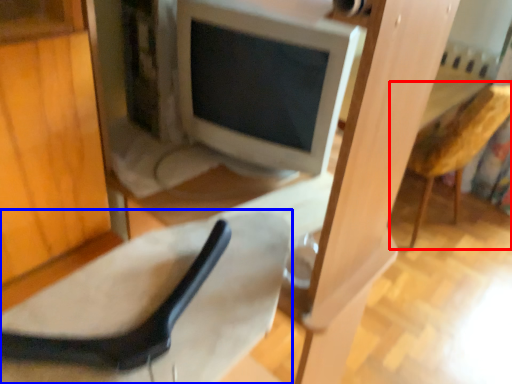
Question: Which of the following is the farthest to the observer, armchair (highlighted by a red box) or chair (highlighted by a blue box)?

Choices:
 (A) armchair
 (B) chair

Answer: (A)